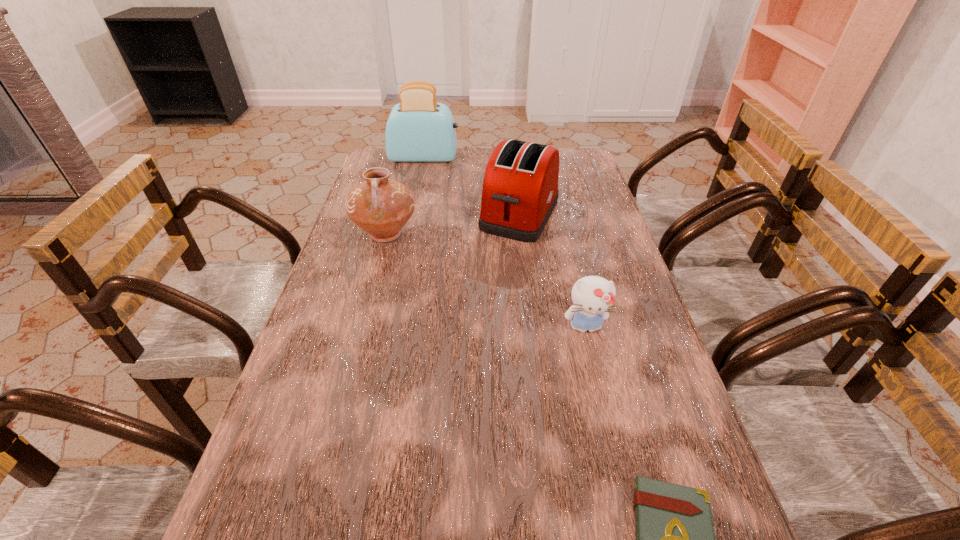
Image resolution: width=960 pixels, height=540 pixels. I want to click on free space located 0.260m on the front-facing side of the kitten, so click(x=613, y=450).

Identify the location of object located in the far edge section of the desktop. (419, 129).

You are a GUI agent. You are given a task and a screenshot of the screen. Output one action in this format:
    pyautogui.click(x=<x>, y=<y>)
    Task: Click on the toaster situated at the left edge
    The width and height of the screenshot is (960, 540).
    Given the screenshot: What is the action you would take?
    tap(419, 129)

Locate an element on the screen. pottery situated at the left edge is located at coordinates (380, 206).

Image resolution: width=960 pixels, height=540 pixels. In order to click on toaster located in the right edge section of the desktop in this screenshot , I will do `click(520, 190)`.

Find the location of a particular element. kitten present at the right edge is located at coordinates (592, 296).

Locate an element on the screen. This screenshot has height=540, width=960. object positioned at the far left corner is located at coordinates (419, 129).

Find the location of a particular element. vacant area at the far edge of the desktop is located at coordinates (449, 175).

In the image, there is a desktop. Where is `vacant region at the left edge`? vacant region at the left edge is located at coordinates (271, 435).

The width and height of the screenshot is (960, 540). What are the coordinates of `vacant region at the right edge of the desktop` in the screenshot? It's located at (655, 349).